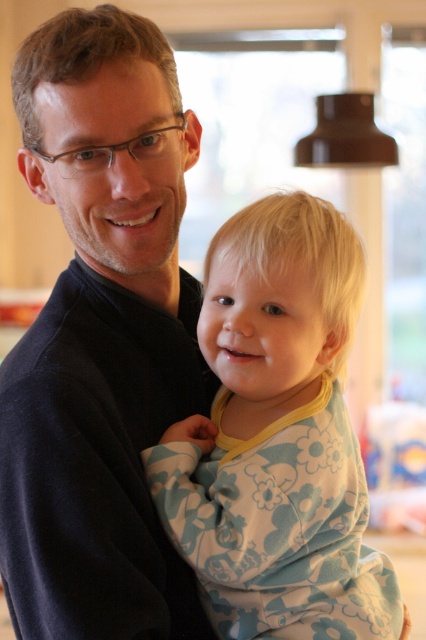
Question: Which of the following is the farthest from the observer?

Choices:
 (A) (365, 486)
 (B) (111, 516)

Answer: (A)

Question: Does dark blue sweater at center have a larger size compared to fluffy cotton onesie at center?

Choices:
 (A) no
 (B) yes

Answer: (B)

Question: Can you confirm if dark blue sweater at center is positioned to the right of fluffy cotton onesie at center?

Choices:
 (A) yes
 (B) no

Answer: (B)

Question: Which point is farther from the camera taking this photo?

Choices:
 (A) (273, 384)
 (B) (155, 172)

Answer: (A)

Question: From the image, what is the correct spatial relationship of dark blue sweater at center in relation to fluffy cotton onesie at center?

Choices:
 (A) above
 (B) below

Answer: (A)

Question: Which of the following is the closest to the observer?

Choices:
 (A) fluffy cotton onesie at center
 (B) dark blue sweater at center

Answer: (B)